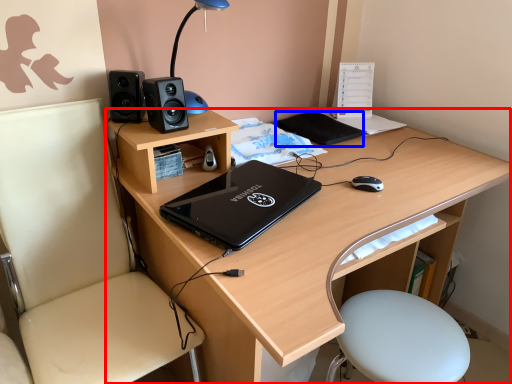
Question: Which of the following is the closest to the observer, desk (highlighted by a red box) or notepad (highlighted by a blue box)?

Choices:
 (A) desk
 (B) notepad

Answer: (A)